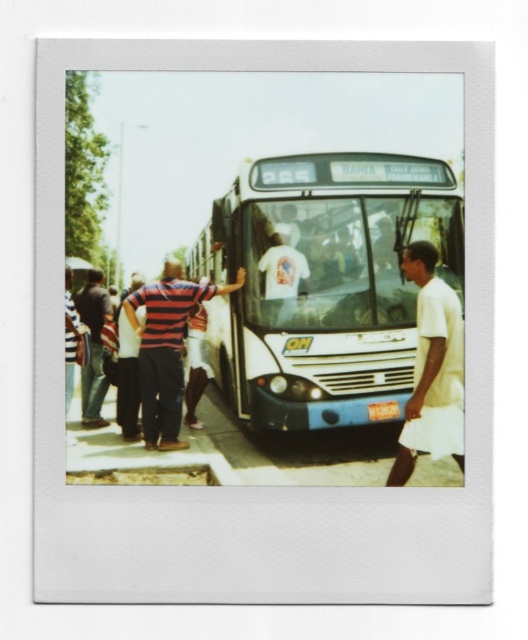
Question: Considering the real-world distances, which object is farthest from the striped shirt at left?

Choices:
 (A) denim pants at left
 (B) striped cotton shirt at center

Answer: (B)

Question: Which object is farther from the camera taking this photo?

Choices:
 (A) white glossy bus at center
 (B) denim pants at left
 (C) striped cotton shirt at center
 (D) striped shirt at left

Answer: (B)

Question: Which object is the farthest from the striped shirt at left?

Choices:
 (A) striped cotton shirt at center
 (B) white glossy bus at center
 (C) white matte shirt at right

Answer: (C)

Question: Does white glossy bus at center have a greater width compared to striped shirt at left?

Choices:
 (A) no
 (B) yes

Answer: (B)

Question: Can you confirm if striped cotton shirt at center is smaller than denim pants at left?

Choices:
 (A) yes
 (B) no

Answer: (B)

Question: Can you confirm if striped cotton shirt at center is smaller than denim pants at left?

Choices:
 (A) yes
 (B) no

Answer: (B)